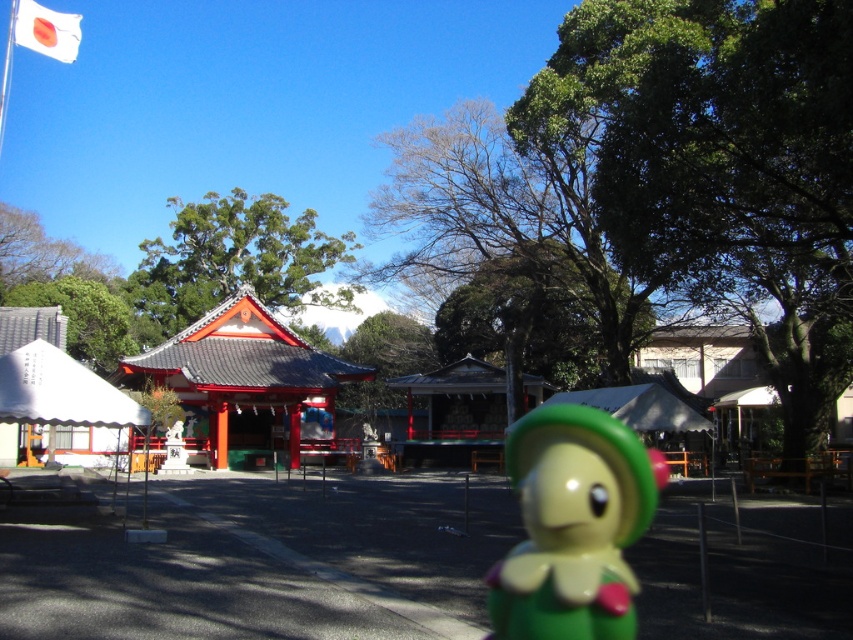
You are a visitor at the shrine and want to take a photo of both the green glossy doll at lower center and the white fabric flag at upper left in the same frame. Which object should you focus on first to ensure both are in the shot?

You should focus on the white fabric flag at upper left first because it is larger than the green glossy doll at lower center, allowing you to frame both objects properly.

You are standing at the point labeled as point (x=32, y=35) and want to walk towards the red and white shrine building. Will the point labeled as point (x=541, y=545) block your path?

Point (x=541, y=545) is in front of point (x=32, y=35), so yes, it will block your path to the shrine building.

You are a visitor at the shrine and want to take a photo of both the green glossy doll at lower center and the white fabric flag at upper left in the same frame. Based on their positions, will you need to adjust your camera angle upwards or downwards to include both?

The green glossy doll at lower center is located below the white fabric flag at upper left, so you will need to adjust your camera angle upwards to include both in the same frame.